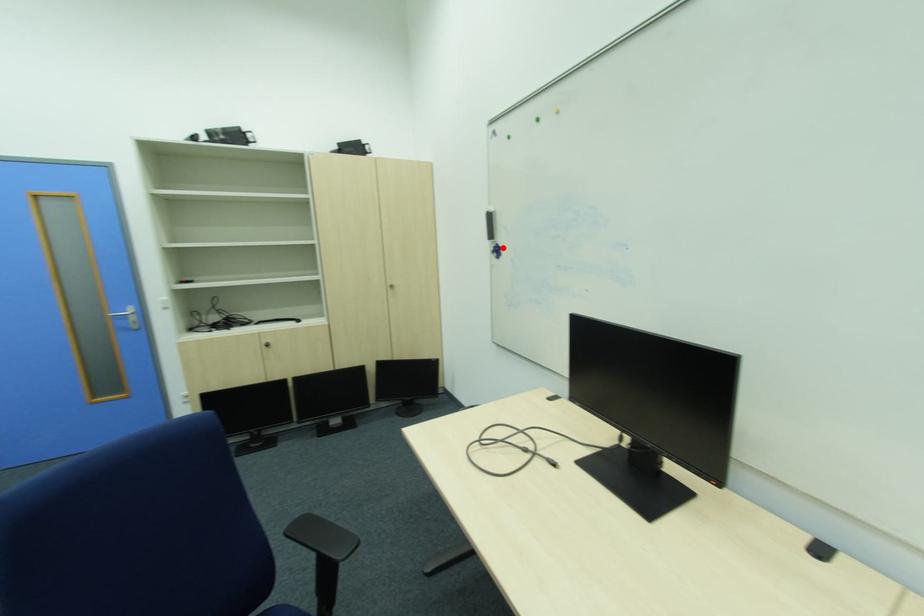
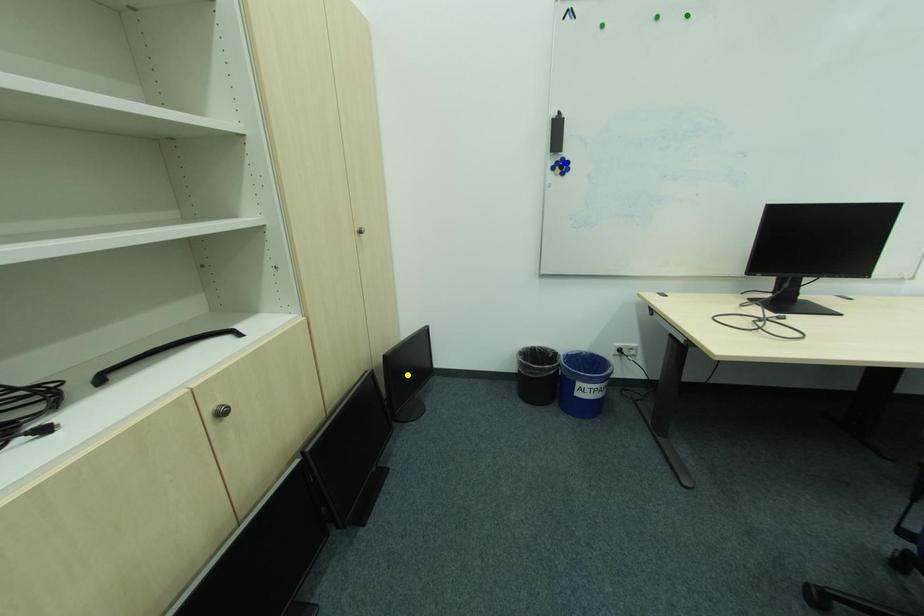
Question: I am providing you with two images of the same scene from different viewpoints. A red point is marked on the first image. You are given multiple points on the second image. In image 2, which mark is for the same physical point as the one in image 1?

Choices:
 (A) yellow point
 (B) blue point
 (C) green point

Answer: (B)